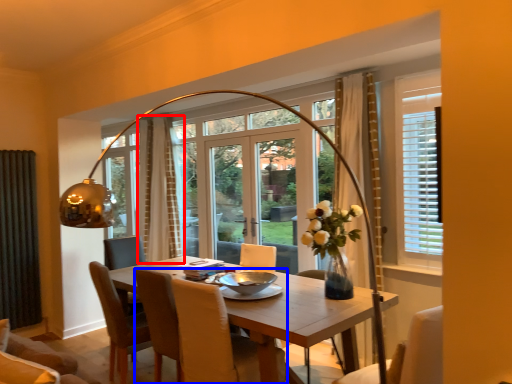
Question: Which point is further to the camera, curtain (highlighted by a red box) or chair (highlighted by a blue box)?

Choices:
 (A) curtain
 (B) chair

Answer: (A)